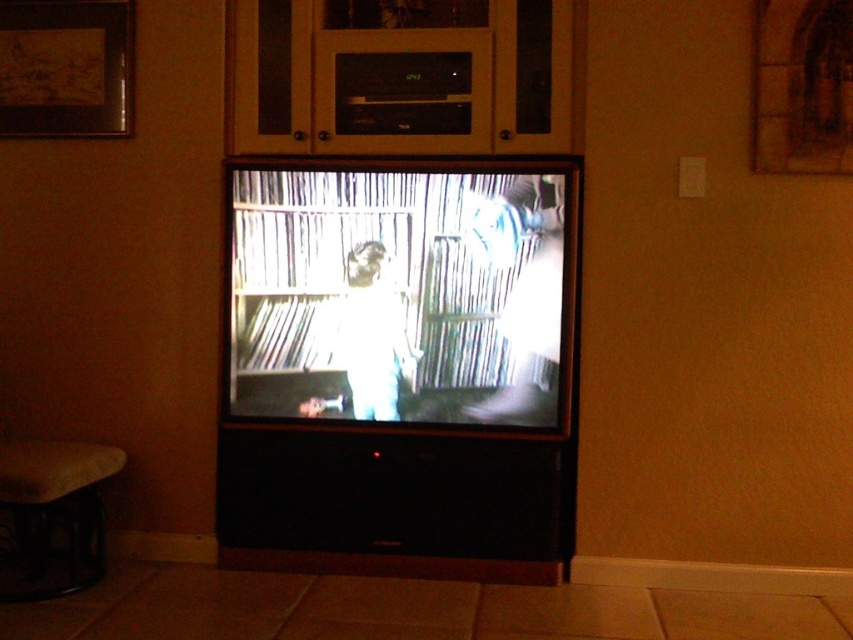
Is point (328, 557) positioned before point (488, 227)?

That is False.

Which is above, black matte television at center or matte black flat screen tv at center?

black matte television at center

Find the location of a particular element. This screenshot has width=853, height=640. black matte television at center is located at coordinates (403, 292).

Image resolution: width=853 pixels, height=640 pixels. Identify the location of black matte television at center. [403, 292].

Is black matte television at center shorter than smooth brown stool at lower left?

Incorrect, black matte television at center's height does not fall short of smooth brown stool at lower left's.

The image size is (853, 640). In order to click on black matte television at center in this screenshot , I will do `click(403, 292)`.

Is point (439, 410) positioned in front of point (100, 497)?

No, it is not.

The width and height of the screenshot is (853, 640). What are the coordinates of `black matte television at center` in the screenshot? It's located at (403, 292).

The width and height of the screenshot is (853, 640). What are the coordinates of `black matte television at center` in the screenshot? It's located at (403, 292).

Does point (399, 385) lie behind point (80, 38)?

No, (399, 385) is in front of (80, 38).

The image size is (853, 640). Find the location of `black matte television at center`. black matte television at center is located at coordinates (403, 292).